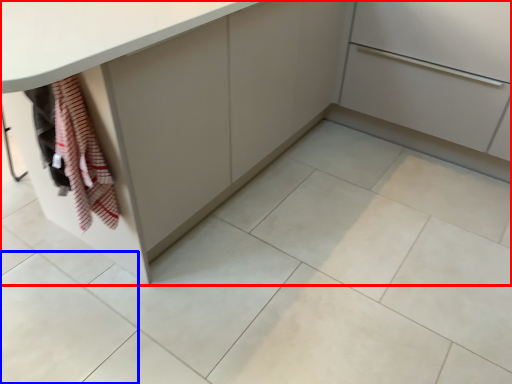
Question: Among these objects, which one is nearest to the camera, cabinetry (highlighted by a red box) or ceramic tile (highlighted by a blue box)?

Choices:
 (A) cabinetry
 (B) ceramic tile

Answer: (A)